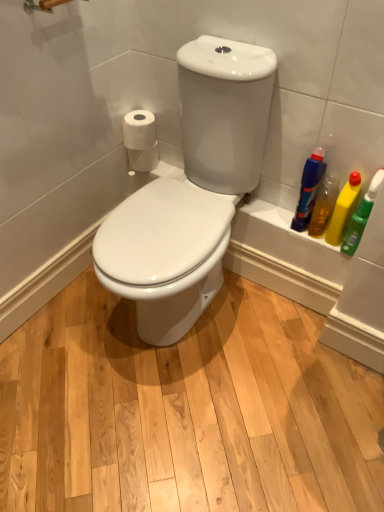
Question: Can you confirm if green plastic bottle at right, the 1th cleaning product from the right, is thinner than white matte toilet paper at left, which appears as the 2th toilet paper when viewed from the front?

Choices:
 (A) no
 (B) yes

Answer: (B)

Question: Is green plastic bottle at right, the 1th cleaning product from the right, looking in the opposite direction of white matte toilet paper at left, acting as the 1th toilet paper starting from the back?

Choices:
 (A) no
 (B) yes

Answer: (A)

Question: Are green plastic bottle at right, the 1th cleaning product from the right, and white matte toilet paper at left, which appears as the 2th toilet paper when viewed from the front, making contact?

Choices:
 (A) no
 (B) yes

Answer: (A)

Question: From a real-world perspective, is green plastic bottle at right, the 4th cleaning product from the left, physically below white matte toilet paper at left, which appears as the 2th toilet paper when viewed from the front?

Choices:
 (A) yes
 (B) no

Answer: (B)

Question: Is green plastic bottle at right, the 1th cleaning product from the right, not near white matte toilet paper at left, which appears as the 2th toilet paper when viewed from the front?

Choices:
 (A) yes
 (B) no

Answer: (B)

Question: Is point (307, 230) closer or farther from the camera than point (311, 173)?

Choices:
 (A) closer
 (B) farther

Answer: (B)

Question: From the image's perspective, is yellow plastic bottle at right, the third cleaning product positioned from the right, positioned above or below translucent plastic bottle at right, which is the 4th cleaning product in right-to-left order?

Choices:
 (A) below
 (B) above

Answer: (A)

Question: Is yellow plastic bottle at right, the third cleaning product positioned from the right, in front of or behind translucent plastic bottle at right, the 1th cleaning product positioned from the left, in the image?

Choices:
 (A) behind
 (B) front

Answer: (A)

Question: Considering the relative positions of yellow plastic bottle at right, the 2th cleaning product when ordered from left to right, and translucent plastic bottle at right, the 1th cleaning product positioned from the left, in the image provided, is yellow plastic bottle at right, the 2th cleaning product when ordered from left to right, to the left or to the right of translucent plastic bottle at right, the 1th cleaning product positioned from the left,?

Choices:
 (A) right
 (B) left

Answer: (A)

Question: In terms of width, does yellow plastic bottle at right, marked as the 2th cleaning product in a right-to-left arrangement, look wider or thinner when compared to translucent plastic bottle at right, the 1th cleaning product positioned from the left?

Choices:
 (A) wide
 (B) thin

Answer: (B)

Question: In terms of size, does yellow plastic bottle at right, marked as the 2th cleaning product in a right-to-left arrangement, appear bigger or smaller than translucent plastic bottle at right, the 1th cleaning product positioned from the left?

Choices:
 (A) big
 (B) small

Answer: (B)

Question: Would you say yellow plastic bottle at right, the third cleaning product from the left, is inside or outside translucent plastic bottle at right, the 1th cleaning product positioned from the left?

Choices:
 (A) inside
 (B) outside

Answer: (B)

Question: Is yellow plastic bottle at right, the third cleaning product from the left, to the left or to the right of translucent plastic bottle at right, which is the 4th cleaning product in right-to-left order, in the image?

Choices:
 (A) right
 (B) left

Answer: (A)

Question: Looking at the image, does white matte toilet paper at left, acting as the 1th toilet paper starting from the back, seem bigger or smaller compared to yellow plastic bottle at right, marked as the 2th cleaning product in a right-to-left arrangement?

Choices:
 (A) small
 (B) big

Answer: (A)

Question: Which is correct: white matte toilet paper at left, which appears as the 2th toilet paper when viewed from the front, is inside yellow plastic bottle at right, the third cleaning product from the left, or outside of it?

Choices:
 (A) outside
 (B) inside

Answer: (A)